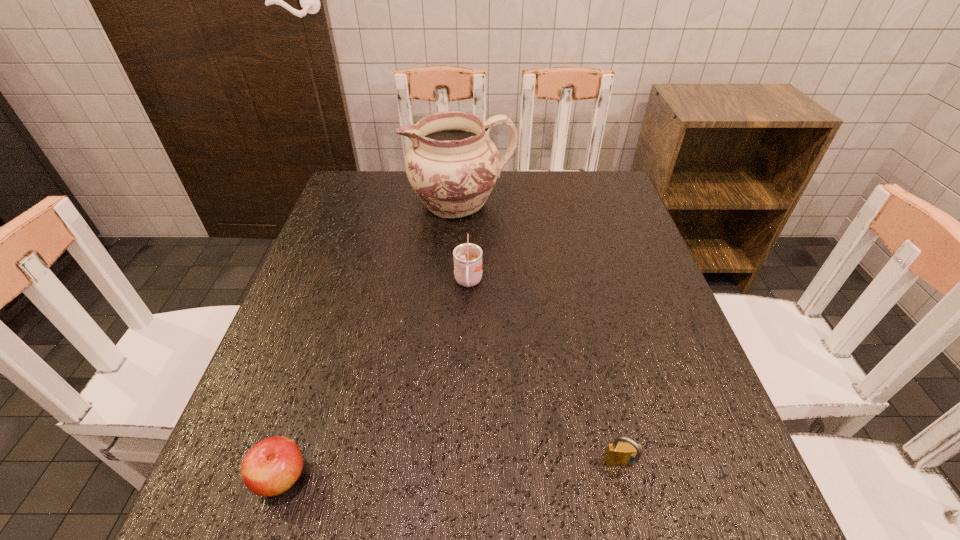
What are the coordinates of `vacant area that lies between the padlock and the leftmost object` in the screenshot? It's located at (451, 471).

Where is `object that ranks as the closest to the pitcher`? The width and height of the screenshot is (960, 540). object that ranks as the closest to the pitcher is located at coordinates (467, 257).

Identify which object is located as the third nearest to the tallest object. Please provide its 2D coordinates. Your answer should be formatted as a tuple, i.e. [(x, y)], where the tuple contains the x and y coordinates of a point satisfying the conditions above.

[(629, 453)]